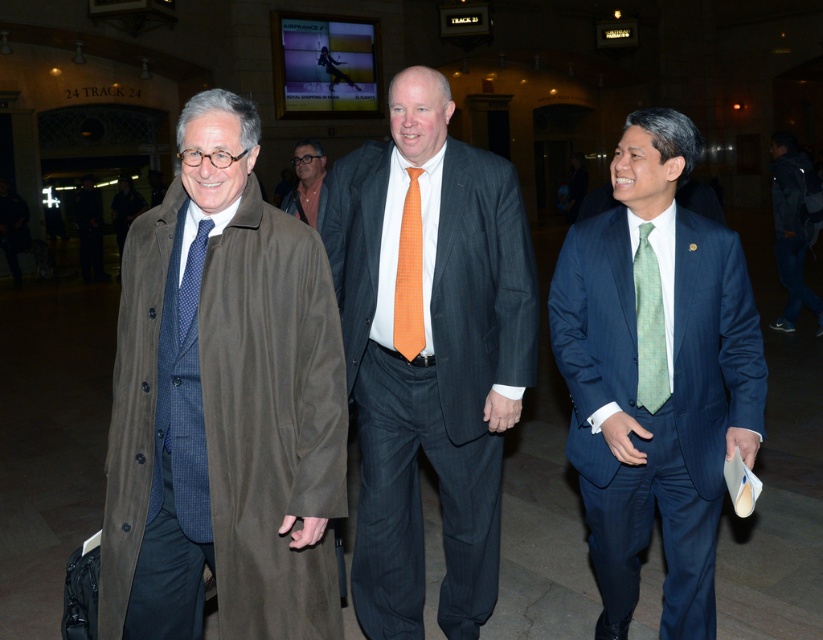
You are standing at the entrance of the train station and want to reach the person wearing the dark blue jeans at lower right. The blue pinstripe suit at center is blocking your path. Can you walk around them without getting too close?

The distance between the blue pinstripe suit at center and dark blue jeans at lower right is 21.82 feet, so you can walk around the blue pinstripe suit at center and maintain a safe distance of over 20 feet while reaching the dark blue jeans at lower right.

You are a photographer trying to capture a closeup of the orange checkered tie at center and the matte black jacket at center. Given their sizes, which one will be easier to fit into the camera frame without zooming in?

The orange checkered tie at center occupies less space than matte black jacket at center, so it will be easier to fit into the camera frame without zooming in.